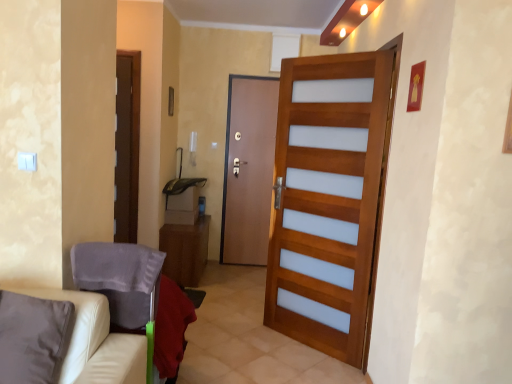
Locate an element on the screen. free region on the left part of wooden door at center, the first door from the front is located at coordinates (234, 349).